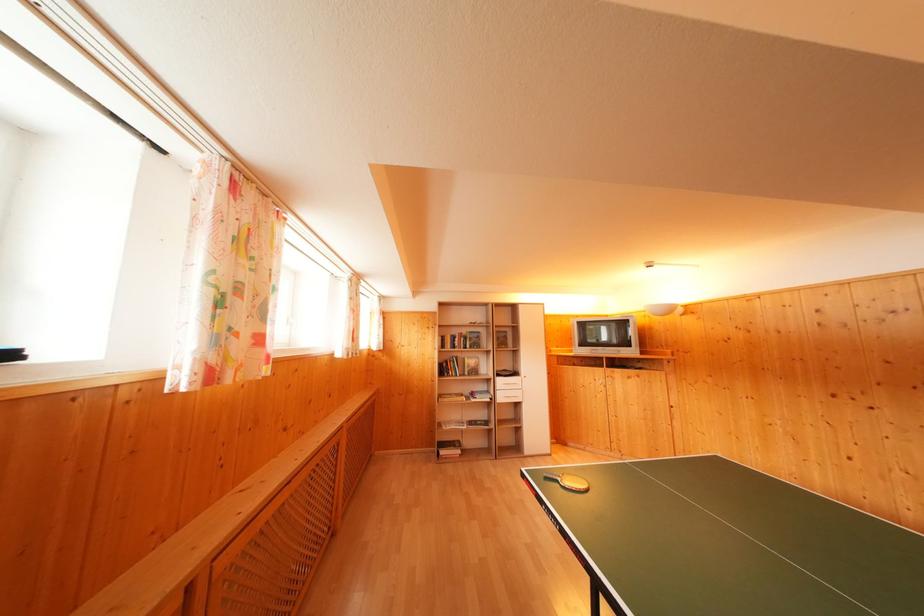
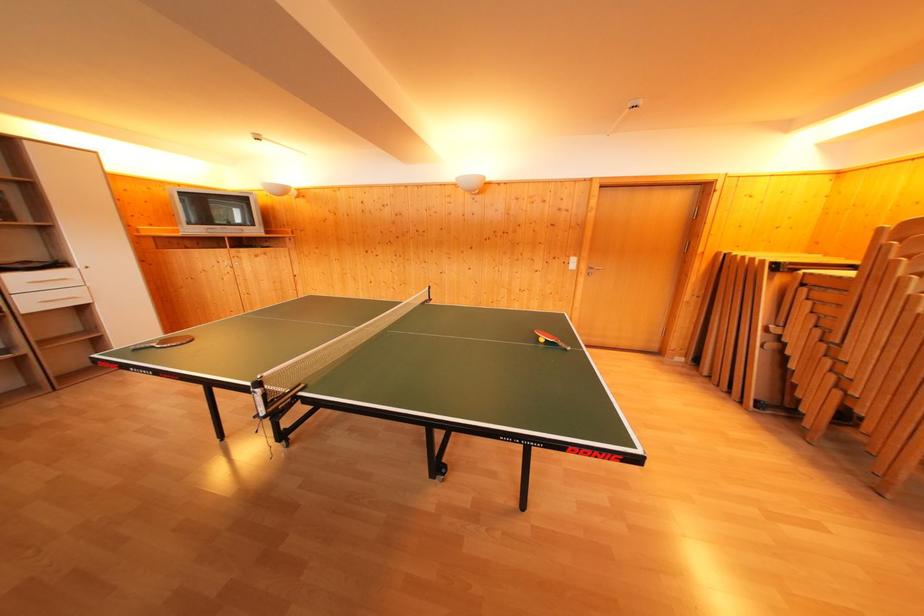
Where in the second image is the point corresponding to [520,379] from the first image?

(64, 270)